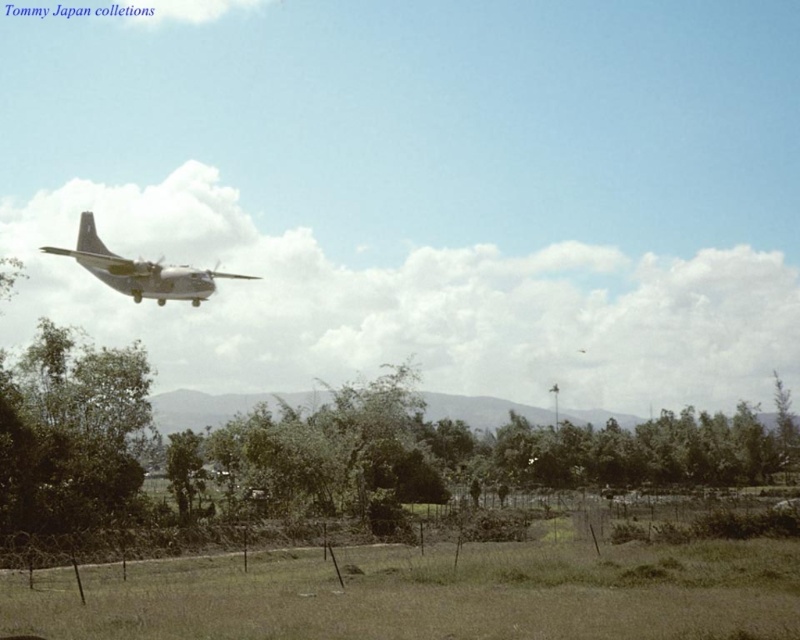
You are a pilot flying a small aircraft and need to land on the green grass at lower center. Considering the metallic gray airplane at upper left is currently in your flight path, which object is closer to the ground and why?

The green grass at lower center is closer to the ground because it has a lesser height compared to the metallic gray airplane at upper left, which is positioned higher in the sky.

You are a pilot flying a small aircraft and need to navigate between two points on the ground below. The points are labeled as point (230, 554) and point (232, 276). Based on the image, which point is closer to your current position?

Point (230, 554) is closer to the viewer than point (232, 276), so the pilot should navigate towards point (230, 554) first as it is nearer to the aircraft.